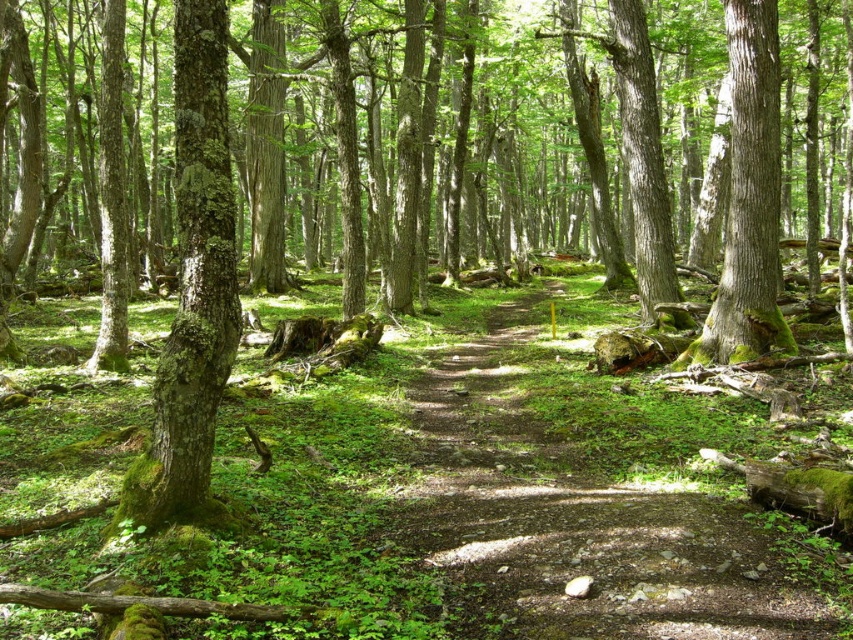
You are a hiker trying to follow the dirt path at center. There is a green mossy bark tree at left nearby. Which direction should you walk to stay on the path?

The dirt path at center is positioned on the right side of the green mossy bark tree at left, so to stay on the path, you should walk towards the right side of the green mossy bark tree at left.

You are a hiker standing on the dirt path at center and want to reach the green mossy tree at right. Which direction should you walk to get closer to the tree?

Since the dirt path at center is closer to the viewer than the green mossy tree at right, you should walk forward along the dirt path at center towards the tree to get closer to the green mossy tree at right.

You are a hiker trying to follow the dirt path at center through the forest. There is also a green mossy tree at right nearby. Which one of these two objects takes up more space in the image?

The dirt path at center is larger in size than the green mossy tree at right, so it takes up more space in the image.